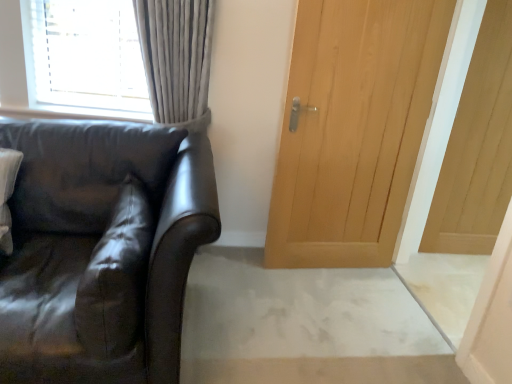
Question: Can you confirm if suede-like brown pillow at left is positioned to the left of light wood paneling at right, which is the 2th door in left-to-right order?

Choices:
 (A) yes
 (B) no

Answer: (A)

Question: From the image's perspective, does suede-like brown pillow at left appear lower than light wood paneling at right, positioned as the 1th door in right-to-left order?

Choices:
 (A) no
 (B) yes

Answer: (B)

Question: Is light wood paneling at right, which is the 2th door in left-to-right order, completely or partially inside suede-like brown pillow at left?

Choices:
 (A) yes
 (B) no

Answer: (B)

Question: Can you confirm if suede-like brown pillow at left is smaller than light wood paneling at right, which is the 2th door in left-to-right order?

Choices:
 (A) yes
 (B) no

Answer: (A)

Question: Considering the relative sizes of suede-like brown pillow at left and light wood paneling at right, which is the 2th door in left-to-right order, in the image provided, is suede-like brown pillow at left shorter than light wood paneling at right, which is the 2th door in left-to-right order,?

Choices:
 (A) no
 (B) yes

Answer: (B)

Question: Considering the positions of suede-like brown pillow at left and matte black leather couch at left in the image, is suede-like brown pillow at left bigger or smaller than matte black leather couch at left?

Choices:
 (A) big
 (B) small

Answer: (B)

Question: In terms of height, does suede-like brown pillow at left look taller or shorter compared to matte black leather couch at left?

Choices:
 (A) short
 (B) tall

Answer: (A)

Question: Considering the positions of point (151, 241) and point (133, 266), is point (151, 241) closer or farther from the camera than point (133, 266)?

Choices:
 (A) farther
 (B) closer

Answer: (A)

Question: From a real-world perspective, is suede-like brown pillow at left physically located above or below matte black leather couch at left?

Choices:
 (A) below
 (B) above

Answer: (B)

Question: Considering the positions of suede-like brown pillow at left and light wood paneling at right, positioned as the 1th door in right-to-left order, in the image, is suede-like brown pillow at left wider or thinner than light wood paneling at right, positioned as the 1th door in right-to-left order,?

Choices:
 (A) wide
 (B) thin

Answer: (A)

Question: Relative to light wood paneling at right, positioned as the 1th door in right-to-left order, is suede-like brown pillow at left in front or behind?

Choices:
 (A) front
 (B) behind

Answer: (A)

Question: Is suede-like brown pillow at left inside or outside of light wood paneling at right, which is the 2th door in left-to-right order?

Choices:
 (A) inside
 (B) outside

Answer: (B)

Question: From the image's perspective, is suede-like brown pillow at left above or below light wood paneling at right, positioned as the 1th door in right-to-left order?

Choices:
 (A) below
 (B) above

Answer: (A)

Question: From a real-world perspective, is matte black leather couch at left above or below light wood paneling at right, which is the 2th door in left-to-right order?

Choices:
 (A) below
 (B) above

Answer: (A)

Question: Would you say matte black leather couch at left is inside or outside light wood paneling at right, which is the 2th door in left-to-right order?

Choices:
 (A) inside
 (B) outside

Answer: (B)